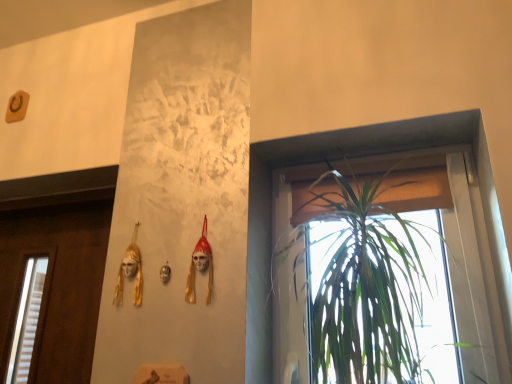
Describe the element at coordinates (368, 266) in the screenshot. I see `green leafy plant at right` at that location.

Where is `green leafy plant at right`? green leafy plant at right is located at coordinates (368, 266).

Measure the distance between green leafy plant at right and camera.

green leafy plant at right and camera are 75.10 centimeters apart.

The width and height of the screenshot is (512, 384). I want to click on green leafy plant at right, so click(368, 266).